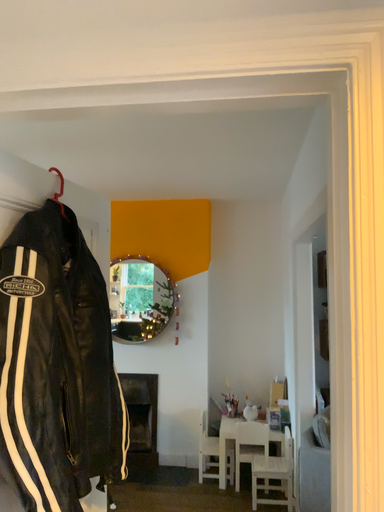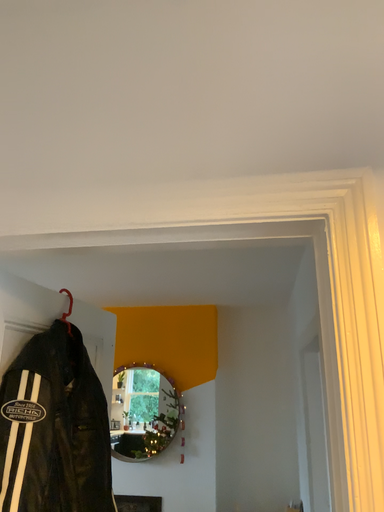
Question: Which way did the camera rotate in the video?

Choices:
 (A) rotated upward
 (B) rotated downward

Answer: (A)